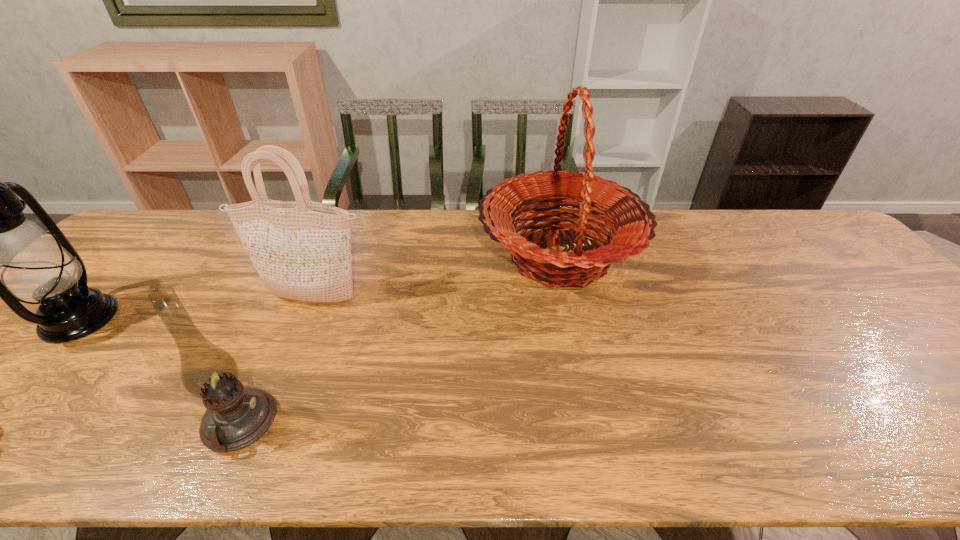
This screenshot has width=960, height=540. In order to click on the rightmost object in this screenshot , I will do `click(628, 217)`.

Where is `shopping bag`? This screenshot has height=540, width=960. shopping bag is located at coordinates (301, 249).

Image resolution: width=960 pixels, height=540 pixels. I want to click on the farther oil lamp, so click(0, 243).

The width and height of the screenshot is (960, 540). Find the location of `the leftmost object`. the leftmost object is located at coordinates (0, 243).

Locate an element on the screen. This screenshot has width=960, height=540. the nearer oil lamp is located at coordinates (236, 416).

The height and width of the screenshot is (540, 960). I want to click on the right oil lamp, so click(236, 416).

Locate an element on the screen. Image resolution: width=960 pixels, height=540 pixels. free space located on the front of the rightmost object is located at coordinates (578, 345).

The height and width of the screenshot is (540, 960). What are the coordinates of `free spot located on the left of the shopping bag` in the screenshot? It's located at (185, 299).

The image size is (960, 540). Identify the location of vacant space located 0.350m on the right of the leftmost object. (249, 319).

Locate an element on the screen. vacant region located 0.350m on the left of the nearer oil lamp is located at coordinates (36, 422).